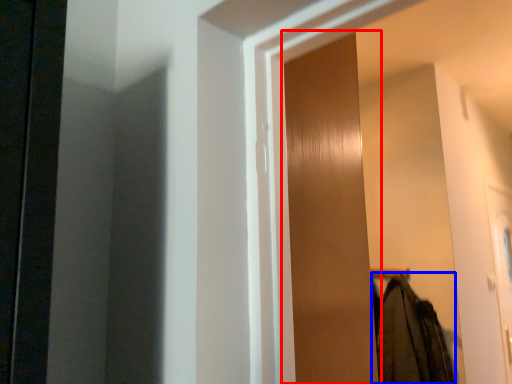
Question: Which point is closer to the camera, screen door (highlighted by a red box) or clothing (highlighted by a blue box)?

Choices:
 (A) screen door
 (B) clothing

Answer: (A)